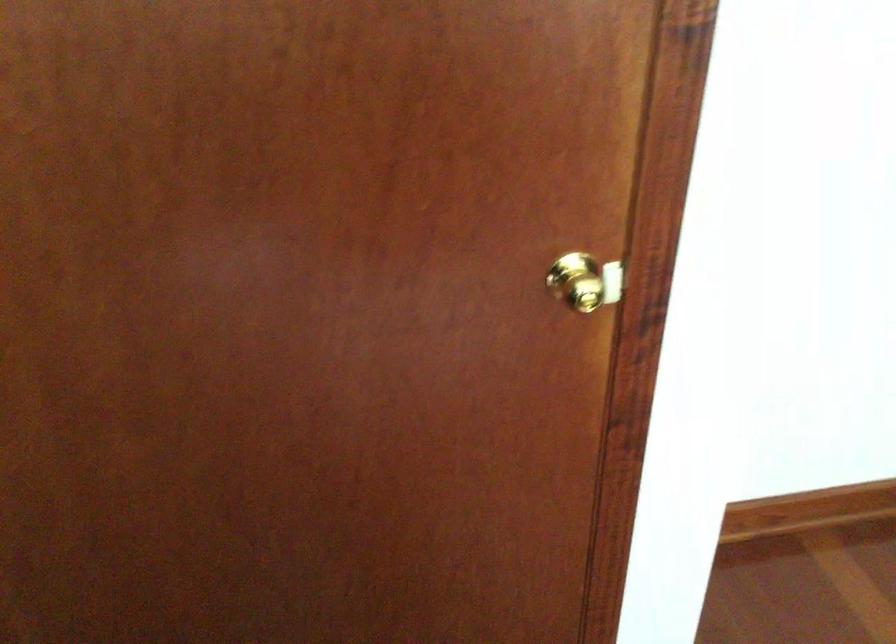
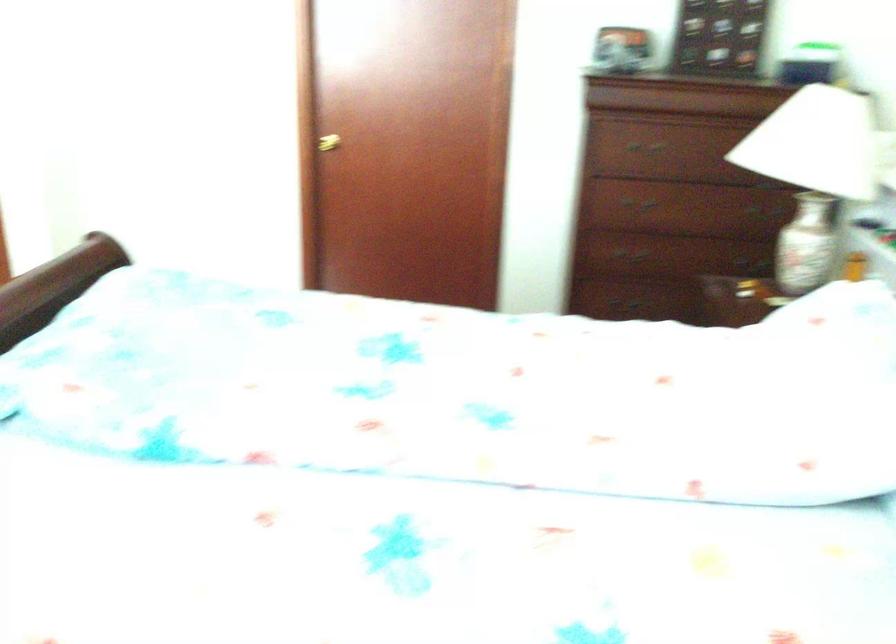
What movement of the cameraman would produce the second image?

The cameraman walked toward right, backward.